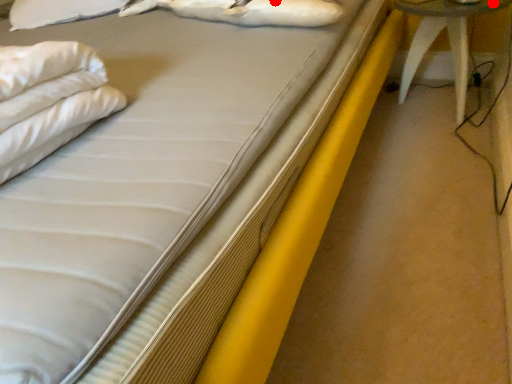
Question: Two points are circled on the image, labeled by A and B beside each circle. Which point is further to the camera?

Choices:
 (A) A is further
 (B) B is further

Answer: (A)